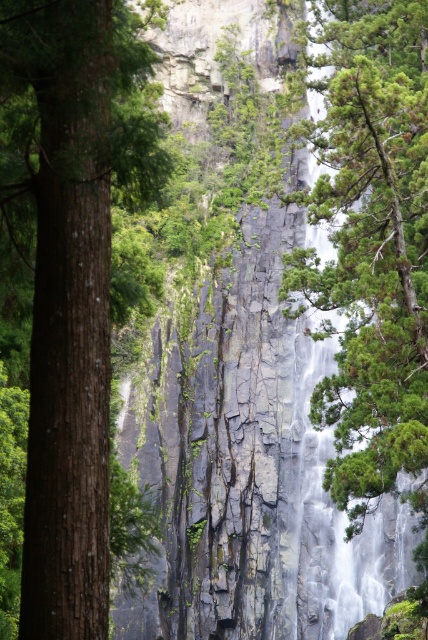
Question: Can you confirm if brown rough tree trunk at left is positioned below green textured tree at right?

Choices:
 (A) yes
 (B) no

Answer: (B)

Question: Which point is closer to the camera?

Choices:
 (A) green textured tree at right
 (B) brown rough tree trunk at left

Answer: (B)

Question: Is brown rough tree trunk at left in front of green textured tree at right?

Choices:
 (A) yes
 (B) no

Answer: (A)

Question: Which of the following is the farthest from the observer?

Choices:
 (A) brown rough tree trunk at left
 (B) green textured tree at right

Answer: (B)

Question: Where is brown rough tree trunk at left located in relation to green textured tree at right in the image?

Choices:
 (A) right
 (B) left

Answer: (B)

Question: Which object is farther from the camera taking this photo?

Choices:
 (A) brown rough tree trunk at left
 (B) green textured tree at right

Answer: (B)